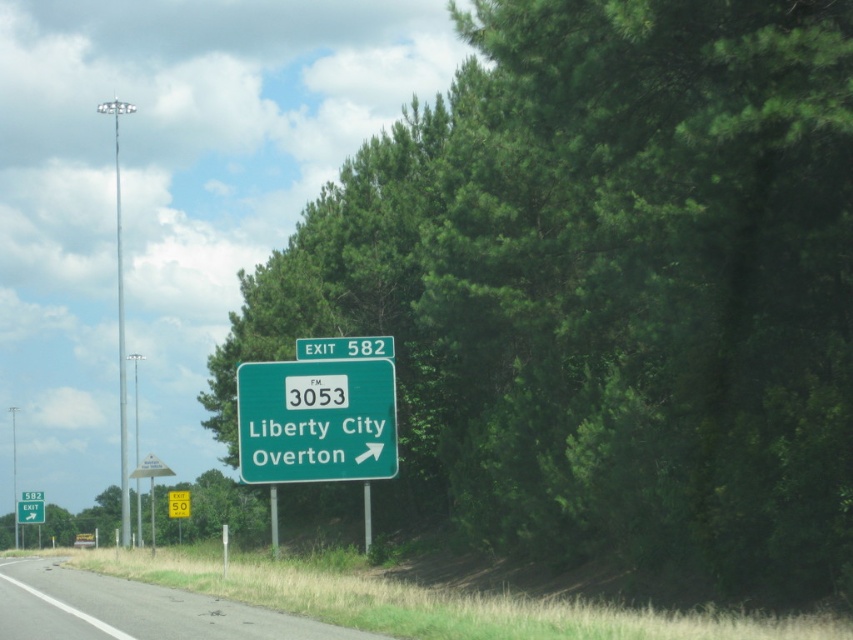
You are driving on the highway and see the green leafy tree at lower left and the green matte sign at center. Which object is closer to your car?

The green leafy tree at lower left is closer to your car because it is further to the viewer than the green matte sign at center, meaning it appears nearer in the scene.

You are driving on the gray asphalt road at lower left and see the green matte sign at center ahead. Can you safely change lanes to the right before reaching the sign?

The gray asphalt road at lower left is positioned under the green matte sign at center, meaning the sign is directly above the road. Since the road is multi lane, you can safely change lanes to the right before reaching the sign as long as there is enough space and no oncoming traffic.

You are driving a car and see the green leafy tree at lower left in the distance. Your car has a 50 meter braking distance. Can you safely stop before hitting the tree?

The green leafy tree at lower left is 64.13 meters away from camera. Since your car can brake within 50 meters, you can safely stop before reaching the tree.